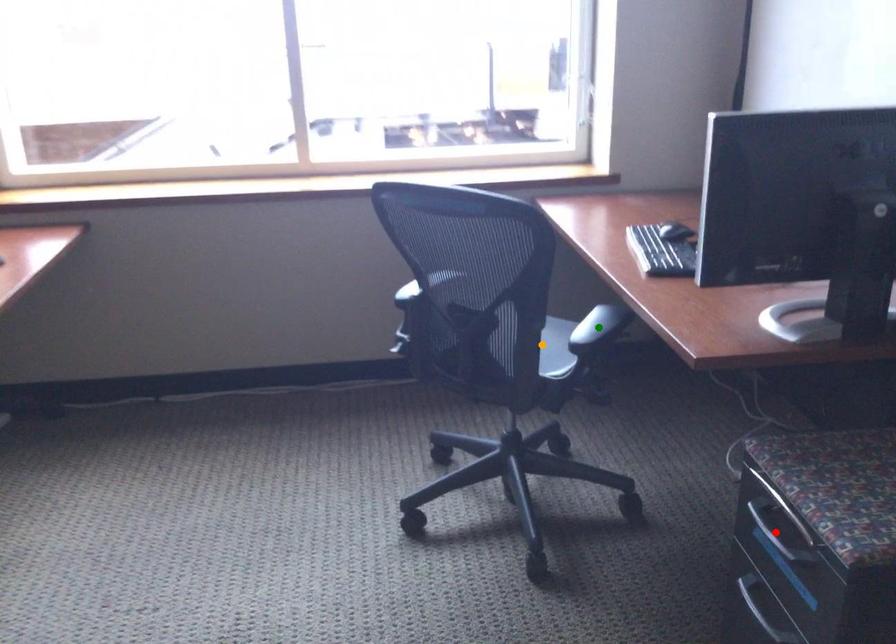
Order these from nearest to farthest:
orange point, green point, red point

1. red point
2. orange point
3. green point